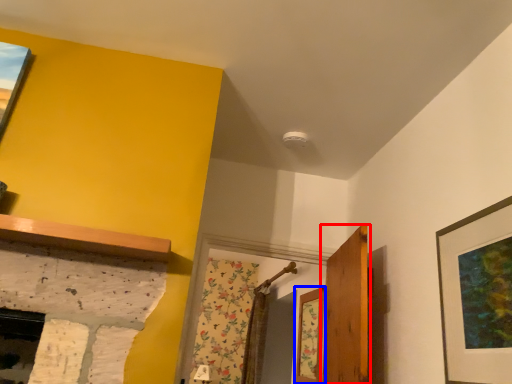
Question: Which of the following is the farthest to the observer, door (highlighted by a red box) or window (highlighted by a blue box)?

Choices:
 (A) door
 (B) window

Answer: (B)